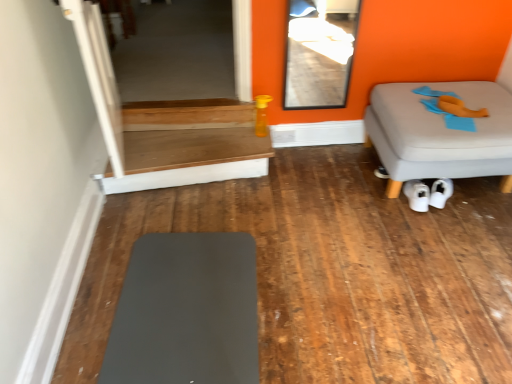
At what (x,y) coordinates should I click in order to perform the action: click on vacant space that is in between gray fabric ottoman at right, the 2th furniture viewed from the front, and matte gray mat at lower left, acting as the first furniture starting from the bottom. Please return your answer as a coordinate pair (x, y). Looking at the image, I should click on (353, 254).